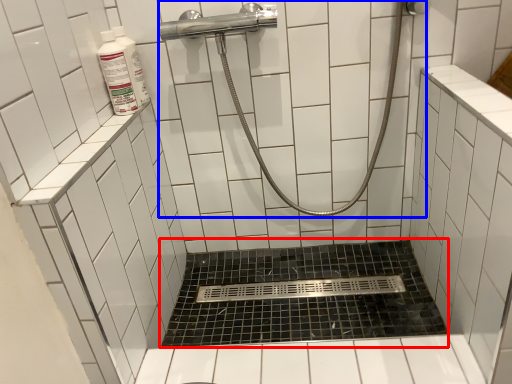
Question: Which point is closer to the camera, bath (highlighted by a red box) or shower (highlighted by a blue box)?

Choices:
 (A) bath
 (B) shower

Answer: (B)